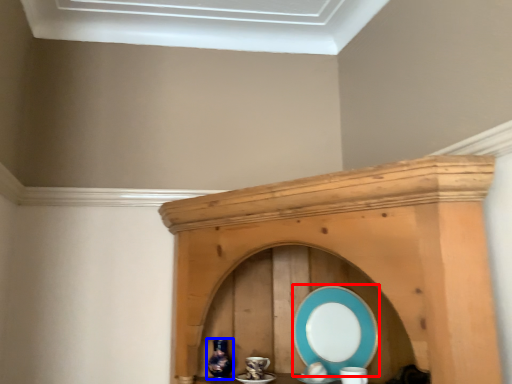
Question: Which object is closer to the camera taking this photo, platter (highlighted by a red box) or vase (highlighted by a blue box)?

Choices:
 (A) platter
 (B) vase

Answer: (A)